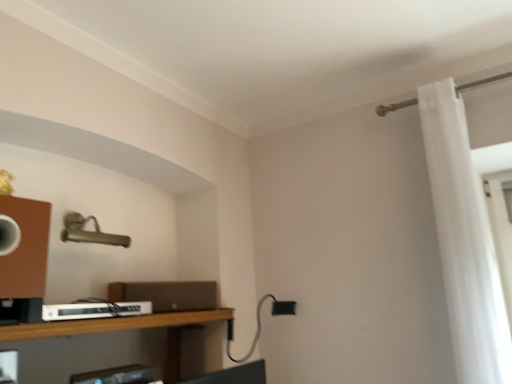
Question: Considering the relative sizes of white sheer curtain at right and wooden shelf at lower left in the image provided, is white sheer curtain at right bigger than wooden shelf at lower left?

Choices:
 (A) no
 (B) yes

Answer: (B)

Question: Could you tell me if white sheer curtain at right is facing wooden shelf at lower left?

Choices:
 (A) no
 (B) yes

Answer: (A)

Question: Does white sheer curtain at right have a greater width compared to wooden shelf at lower left?

Choices:
 (A) no
 (B) yes

Answer: (A)

Question: Can we say white sheer curtain at right lies outside wooden shelf at lower left?

Choices:
 (A) no
 (B) yes

Answer: (B)

Question: Are white sheer curtain at right and wooden shelf at lower left far apart?

Choices:
 (A) yes
 (B) no

Answer: (A)

Question: In terms of width, does white sheer curtain at right look wider or thinner when compared to wooden shelf at lower left?

Choices:
 (A) thin
 (B) wide

Answer: (A)

Question: In terms of size, does white sheer curtain at right appear bigger or smaller than wooden shelf at lower left?

Choices:
 (A) big
 (B) small

Answer: (A)

Question: Is white sheer curtain at right taller or shorter than wooden shelf at lower left?

Choices:
 (A) tall
 (B) short

Answer: (A)

Question: Visually, is white sheer curtain at right positioned to the left or to the right of wooden shelf at lower left?

Choices:
 (A) right
 (B) left

Answer: (A)

Question: Considering the positions of white plastic cable box at lower left and white sheer curtain at right in the image, is white plastic cable box at lower left wider or thinner than white sheer curtain at right?

Choices:
 (A) thin
 (B) wide

Answer: (B)

Question: Does point (68, 316) appear closer or farther from the camera than point (449, 155)?

Choices:
 (A) farther
 (B) closer

Answer: (B)

Question: Do you think white plastic cable box at lower left is within white sheer curtain at right, or outside of it?

Choices:
 (A) outside
 (B) inside

Answer: (A)

Question: From the image's perspective, relative to white sheer curtain at right, is white plastic cable box at lower left above or below?

Choices:
 (A) above
 (B) below

Answer: (B)

Question: In terms of width, does wooden shelf at lower left look wider or thinner when compared to white plastic cable box at lower left?

Choices:
 (A) thin
 (B) wide

Answer: (B)

Question: In the image, is wooden shelf at lower left positioned in front of or behind white plastic cable box at lower left?

Choices:
 (A) behind
 (B) front

Answer: (B)